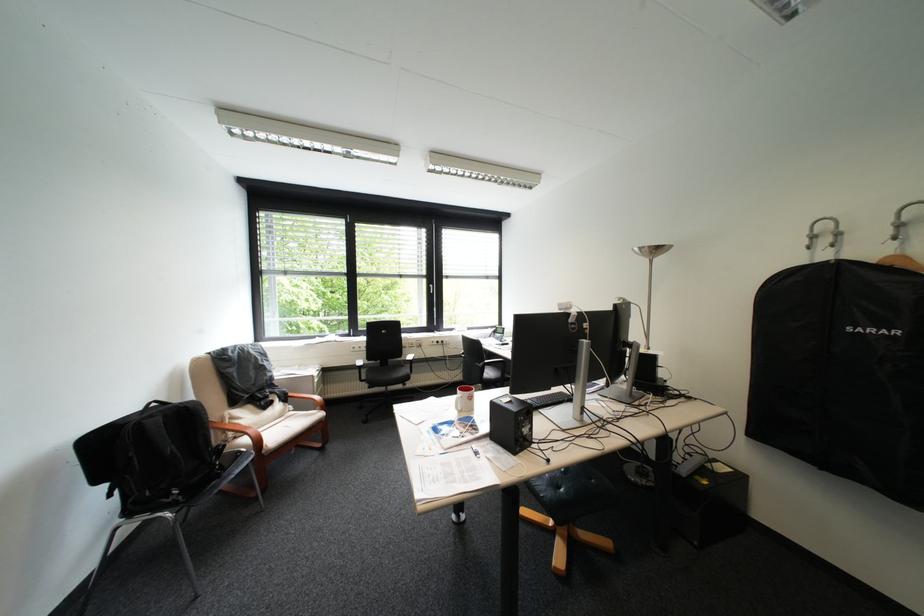
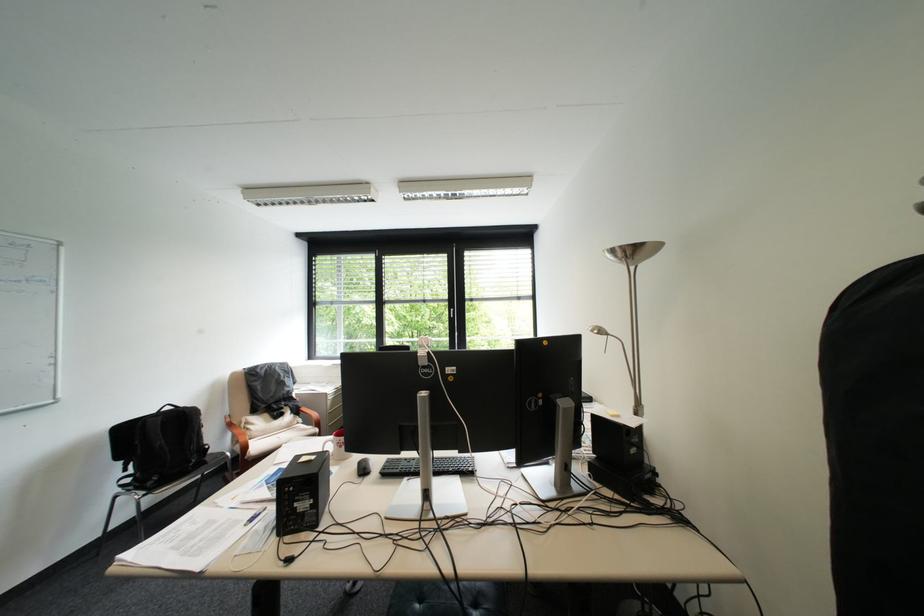
Where in the second image is the point corresponding to pixel 651 248 from the first image?

(625, 252)